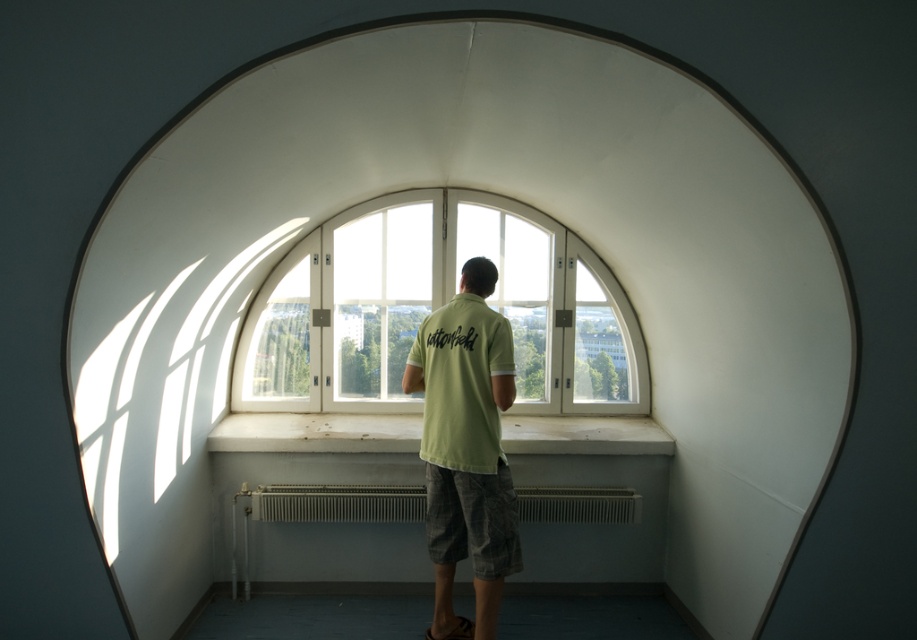
Which is in front, point (624, 408) or point (274, 488)?

Point (274, 488) is in front.

Is clear glass window at center taller than white metallic radiator at lower center?

Correct, clear glass window at center is much taller as white metallic radiator at lower center.

Is point (514, 257) behind point (590, 497)?

Yes.

You are a GUI agent. You are given a task and a screenshot of the screen. Output one action in this format:
    pyautogui.click(x=<x>, y=<y>)
    Task: Click on the clear glass window at center
    The height and width of the screenshot is (640, 917).
    Given the screenshot: What is the action you would take?
    click(x=435, y=308)

From the picture: Does clear glass window at center have a greater width compared to green cotton t-shirt at center?

Indeed, clear glass window at center has a greater width compared to green cotton t-shirt at center.

Can you confirm if clear glass window at center is smaller than green cotton t-shirt at center?

No, clear glass window at center is not smaller than green cotton t-shirt at center.

Which is behind, point (424, 240) or point (485, 417)?

Point (424, 240)

This screenshot has width=917, height=640. What are the coordinates of `clear glass window at center` in the screenshot? It's located at (435, 308).

Is clear glass window at center further to the viewer compared to light green t-shirt at center?

Yes, it is.

Which is more to the left, clear glass window at center or light green t-shirt at center?

From the viewer's perspective, clear glass window at center appears more on the left side.

The height and width of the screenshot is (640, 917). What do you see at coordinates (435, 308) in the screenshot?
I see `clear glass window at center` at bounding box center [435, 308].

Locate an element on the screen. clear glass window at center is located at coordinates (435, 308).